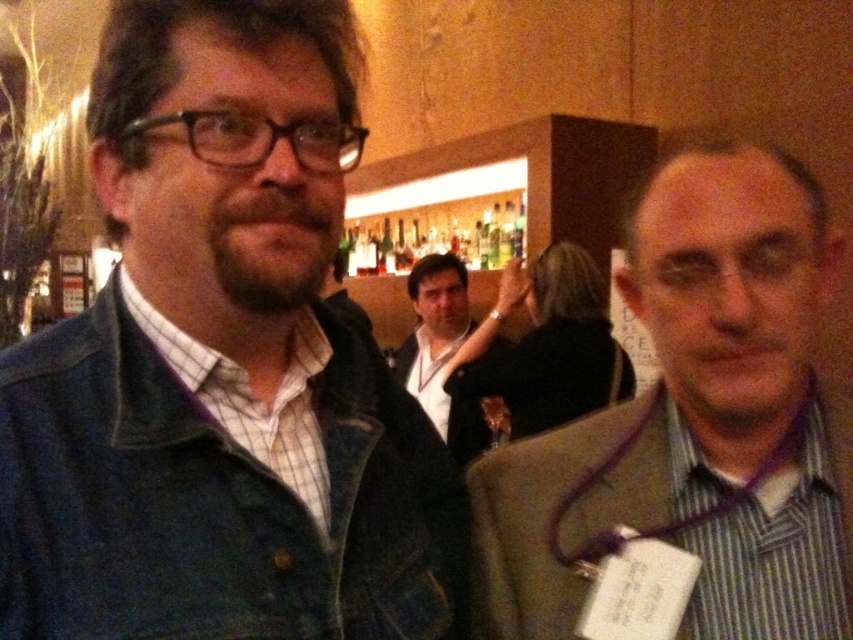
Can you confirm if black leather jacket at center is positioned below green glass bottles at center?

Correct, black leather jacket at center is located below green glass bottles at center.

Where is `black leather jacket at center`? The width and height of the screenshot is (853, 640). black leather jacket at center is located at coordinates (451, 346).

At what (x,y) coordinates should I click in order to perform the action: click on black leather jacket at center. Please return your answer as a coordinate pair (x, y). The image size is (853, 640). Looking at the image, I should click on (451, 346).

Based on the photo, is denim jacket at left thinner than green glass bottles at center?

Yes, denim jacket at left is thinner than green glass bottles at center.

Who is more forward, (259,294) or (485,264)?

Point (259,294)

Describe the element at coordinates (221, 365) in the screenshot. This screenshot has width=853, height=640. I see `denim jacket at left` at that location.

Where is `denim jacket at left`? This screenshot has width=853, height=640. denim jacket at left is located at coordinates (221, 365).

Does striped fabric shirt at right have a greater width compared to green glass bottles at center?

In fact, striped fabric shirt at right might be narrower than green glass bottles at center.

Between point (585, 550) and point (387, 243), which one is positioned behind?

The point (387, 243) is more distant.

Locate an element on the screen. The width and height of the screenshot is (853, 640). striped fabric shirt at right is located at coordinates (689, 436).